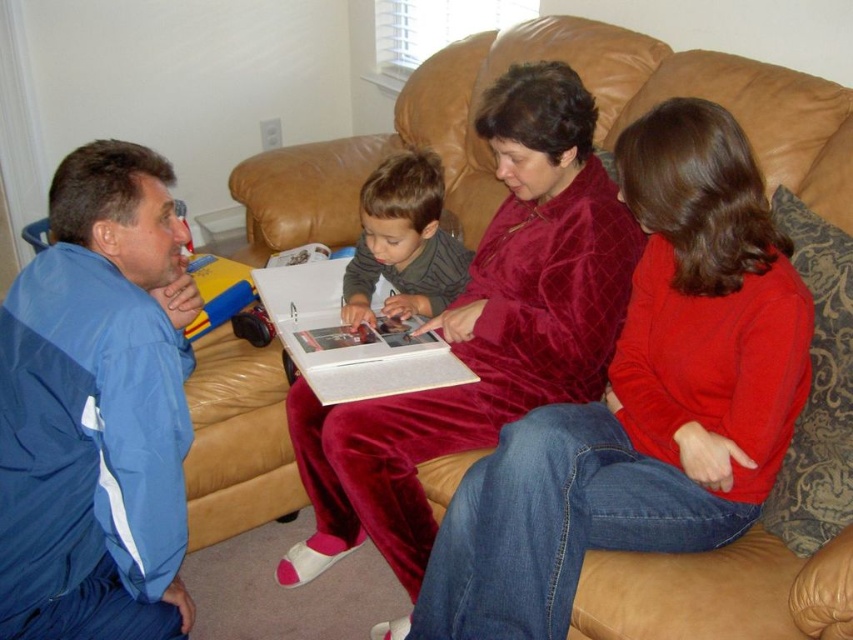
Does point (457, 637) come in front of point (7, 388)?

No, it is behind (7, 388).

Describe the element at coordinates (642, 400) in the screenshot. Image resolution: width=853 pixels, height=640 pixels. I see `velvet red sweater at center` at that location.

This screenshot has width=853, height=640. I want to click on velvet red sweater at center, so click(x=642, y=400).

Who is more forward, (659, 241) or (415, 240)?

Point (659, 241) is more forward.

Who is taller, velvet red sweater at center or velvet-like sweater at center?

velvet red sweater at center is taller.

Which is behind, point (486, 570) or point (409, 288)?

The point (409, 288) is behind.

Locate an element on the screen. The height and width of the screenshot is (640, 853). velvet red sweater at center is located at coordinates (642, 400).

How far apart are blue fabric jacket at lower left and velvet maroon pajamas at center?

They are 21.19 inches apart.

At what (x,y) coordinates should I click in order to perform the action: click on blue fabric jacket at lower left. Please return your answer as a coordinate pair (x, y). This screenshot has width=853, height=640. Looking at the image, I should click on (97, 408).

You are a GUI agent. You are given a task and a screenshot of the screen. Output one action in this format:
    pyautogui.click(x=<x>, y=<y>)
    Task: Click on the blue fabric jacket at lower left
    The image size is (853, 640).
    Given the screenshot: What is the action you would take?
    pyautogui.click(x=97, y=408)